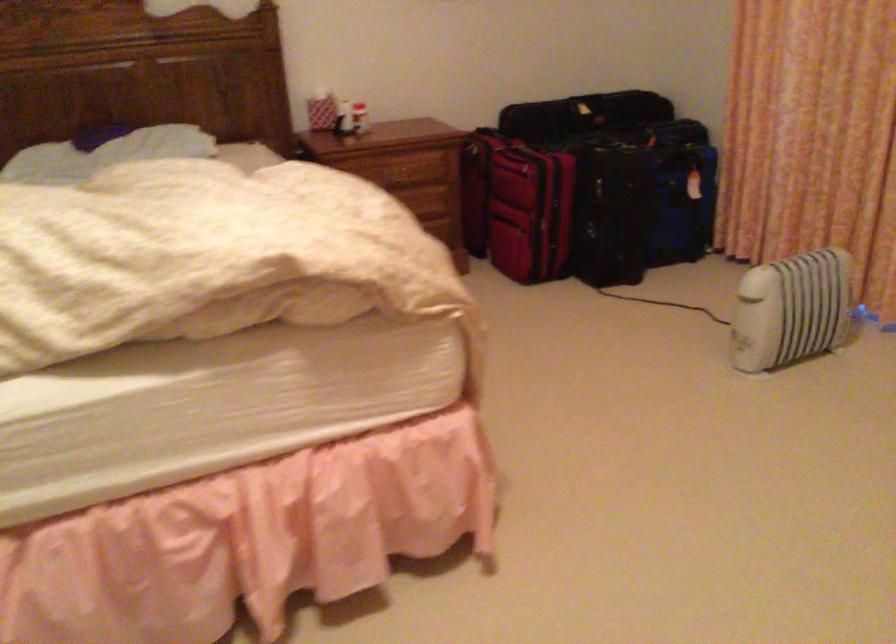
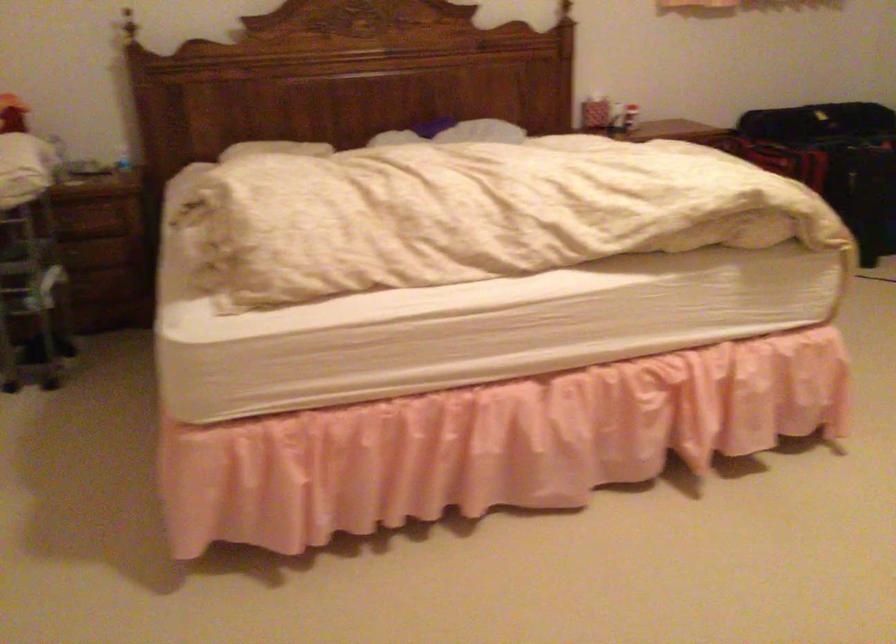
The point at (306, 127) is marked in the first image. Where is the corresponding point in the second image?

(590, 109)